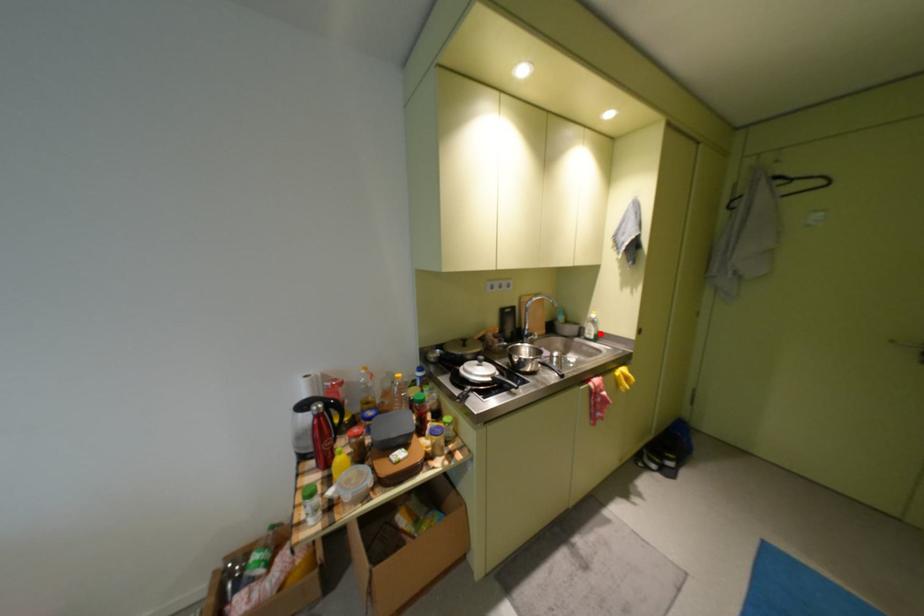
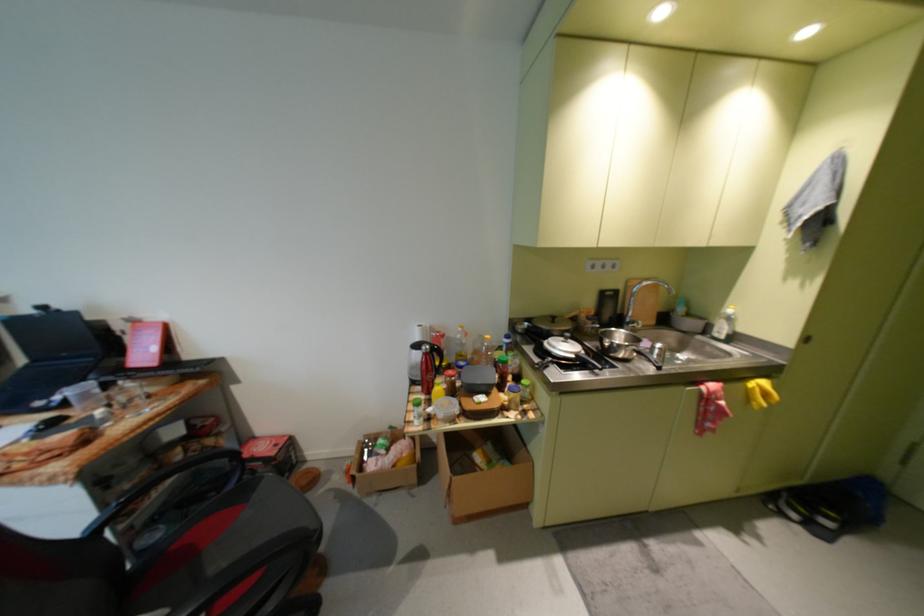
In the second image, find the point that corresponds to the highlighted location in the first image.

(732, 331)